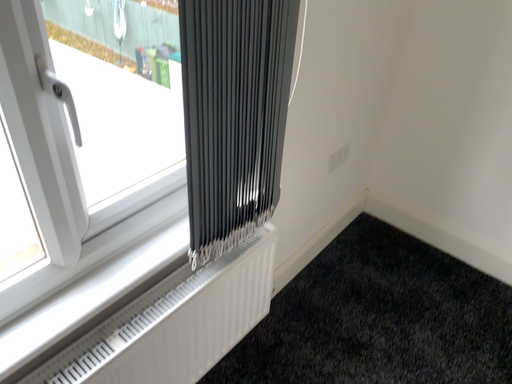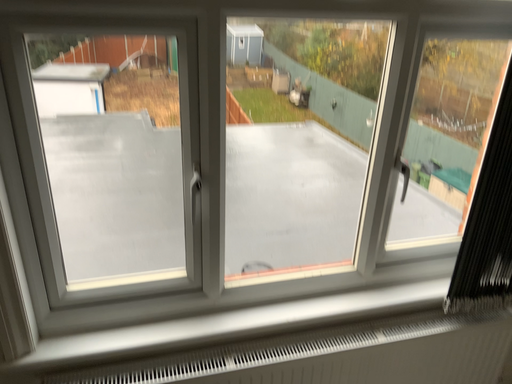
Question: Which way did the camera rotate in the video?

Choices:
 (A) rotated upward
 (B) rotated downward

Answer: (A)